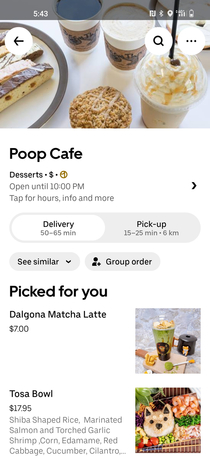
Locate an element on the screen. The image size is (210, 467). plate is located at coordinates pos(38,107).